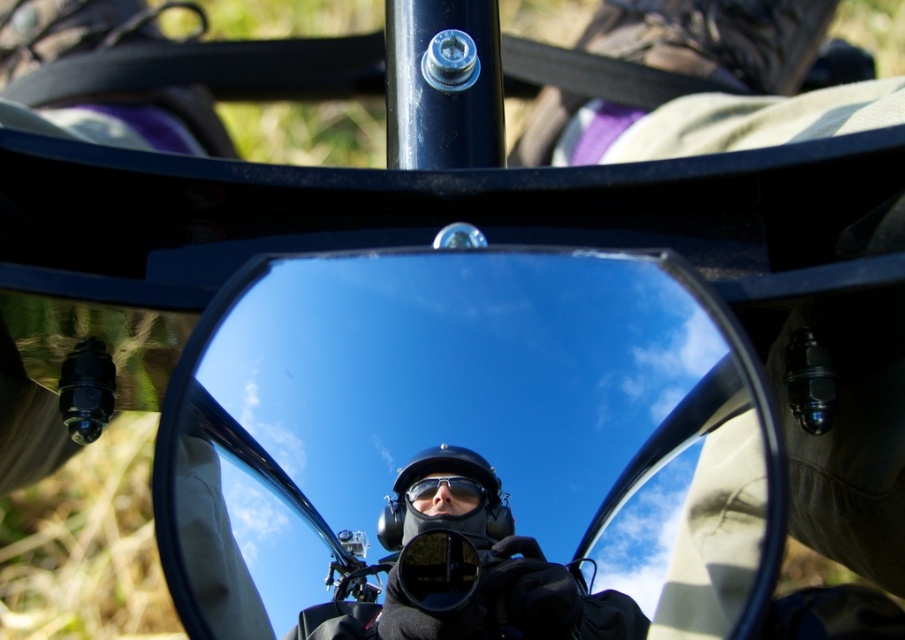
In the scene shown: You are a photographer trying to capture a self portrait using the motorcycle side mirror. The mirror is at the center. Where exactly should you position your camera to ensure it captures your reflection in the glossy black mirror at center?

To capture your reflection in the glossy black mirror at center, position your camera at point (469, 451) where the mirror is located.